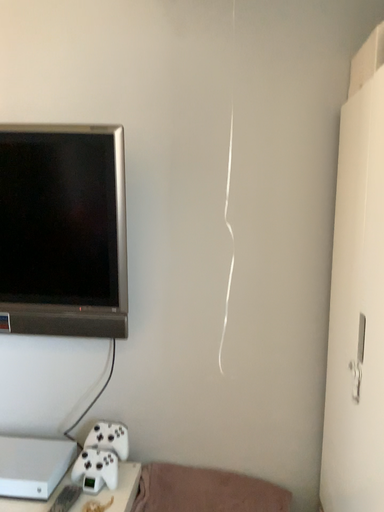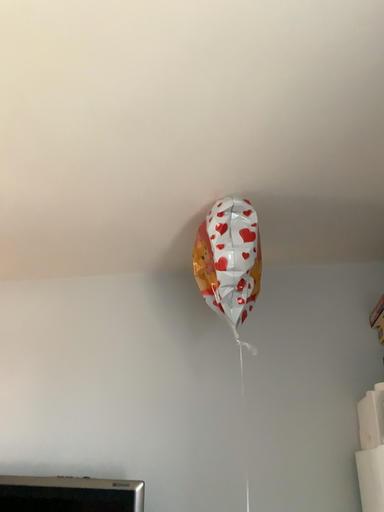
Question: Which way did the camera rotate in the video?

Choices:
 (A) rotated downward
 (B) rotated upward

Answer: (B)